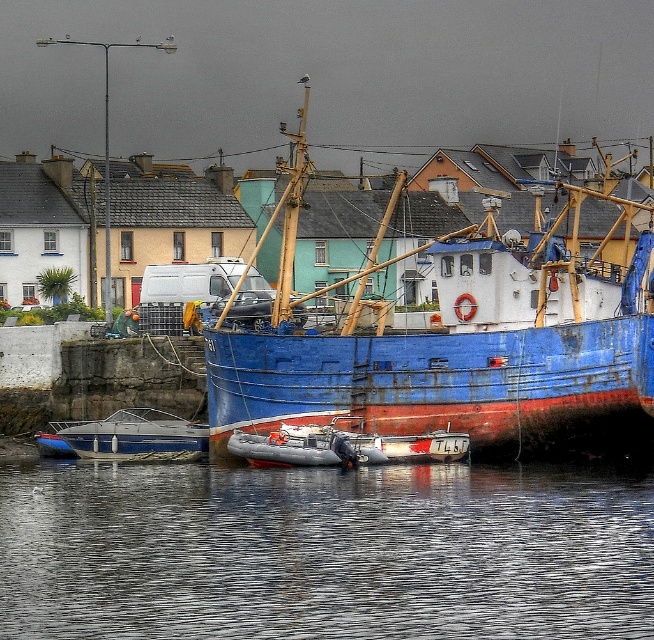
Does point (525, 634) come closer to viewer compared to point (462, 266)?

Yes, point (525, 634) is closer to viewer.

Can you confirm if smooth water at lower center is shorter than blue painted wooden boat at center?

Indeed, smooth water at lower center has a lesser height compared to blue painted wooden boat at center.

Who is more distant from viewer, (623,490) or (264,428)?

Point (264,428)

Find the location of `smooth water at lower center`. smooth water at lower center is located at coordinates (324, 550).

Can you confirm if smooth water at lower center is bigger than metallic gray dinghy at lower left?

Indeed, smooth water at lower center has a larger size compared to metallic gray dinghy at lower left.

This screenshot has height=640, width=654. What do you see at coordinates (324, 550) in the screenshot?
I see `smooth water at lower center` at bounding box center [324, 550].

Which is behind, point (277, 593) or point (120, 458)?

The point (120, 458) is behind.

Where is `smooth water at lower center`? The width and height of the screenshot is (654, 640). smooth water at lower center is located at coordinates (324, 550).

Who is shorter, blue painted wooden boat at center or metallic gray dinghy at lower left?

Standing shorter between the two is metallic gray dinghy at lower left.

Which is below, blue painted wooden boat at center or metallic gray dinghy at lower left?

metallic gray dinghy at lower left is lower down.

Looking at this image, who is more forward, (307,333) or (135,458)?

Positioned in front is point (307,333).

Identify the location of blue painted wooden boat at center. The image size is (654, 640). (462, 346).